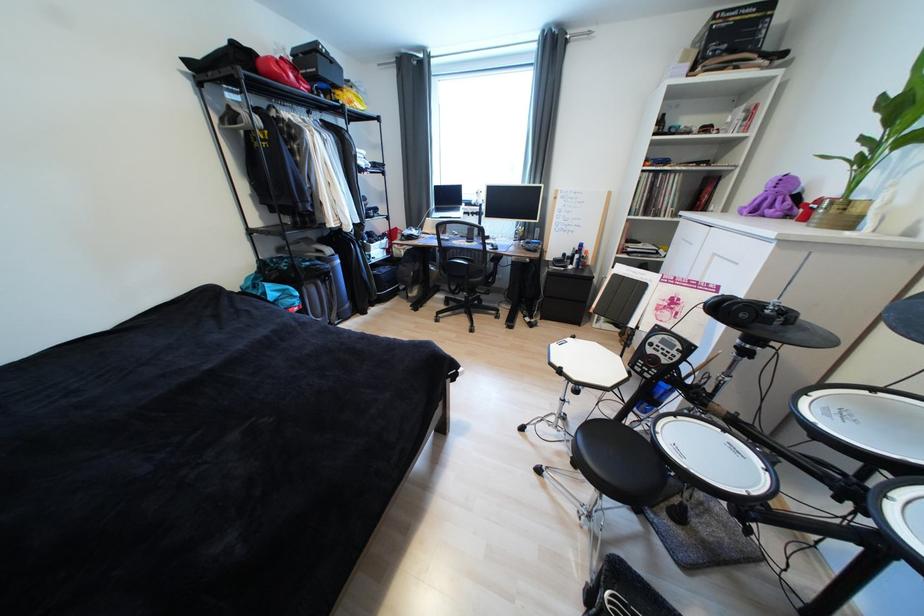
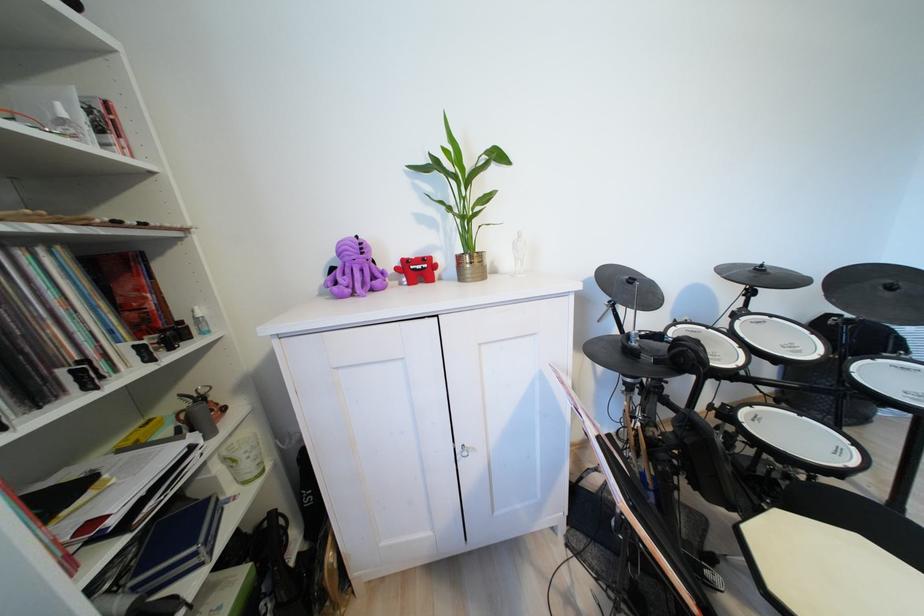
The point at (x=843, y=209) is marked in the first image. Where is the corresponding point in the second image?

(482, 262)